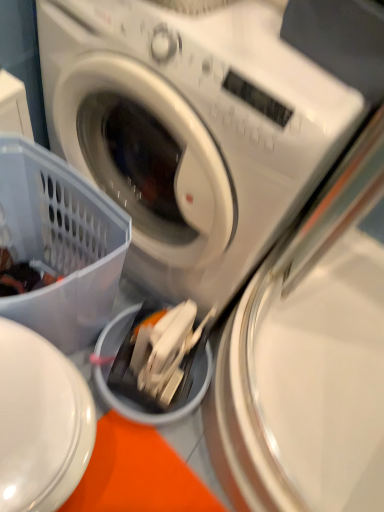
Question: Is white plastic washing machine at center, the first washing machine when ordered from top to bottom, further to the viewer compared to metallic silver washing machine at center, which appears as the 1th washing machine when ordered from the bottom?

Choices:
 (A) yes
 (B) no

Answer: (B)

Question: Is metallic silver washing machine at center, which appears as the 1th washing machine when ordered from the bottom, inside white plastic washing machine at center, the first washing machine when ordered from top to bottom?

Choices:
 (A) no
 (B) yes

Answer: (A)

Question: Is white plastic washing machine at center, positioned as the 2th washing machine in bottom-to-top order, oriented towards metallic silver washing machine at center, positioned as the 2th washing machine in top-to-bottom order?

Choices:
 (A) yes
 (B) no

Answer: (B)

Question: Considering the relative positions of white plastic washing machine at center, positioned as the 2th washing machine in bottom-to-top order, and metallic silver washing machine at center, positioned as the 2th washing machine in top-to-bottom order, in the image provided, is white plastic washing machine at center, positioned as the 2th washing machine in bottom-to-top order, to the right of metallic silver washing machine at center, positioned as the 2th washing machine in top-to-bottom order, from the viewer's perspective?

Choices:
 (A) no
 (B) yes

Answer: (A)

Question: Does white plastic washing machine at center, the first washing machine when ordered from top to bottom, have a smaller size compared to metallic silver washing machine at center, positioned as the 2th washing machine in top-to-bottom order?

Choices:
 (A) yes
 (B) no

Answer: (B)

Question: Is translucent plastic basket at lower left inside or outside of metallic silver washing machine at center, positioned as the 2th washing machine in top-to-bottom order?

Choices:
 (A) outside
 (B) inside

Answer: (A)

Question: In the image, is translucent plastic basket at lower left positioned in front of or behind metallic silver washing machine at center, positioned as the 2th washing machine in top-to-bottom order?

Choices:
 (A) behind
 (B) front

Answer: (B)

Question: From a real-world perspective, is translucent plastic basket at lower left positioned above or below metallic silver washing machine at center, which appears as the 1th washing machine when ordered from the bottom?

Choices:
 (A) above
 (B) below

Answer: (A)

Question: Is point (69, 344) positioned closer to the camera than point (228, 401)?

Choices:
 (A) farther
 (B) closer

Answer: (A)

Question: Is white plastic washing machine at center, positioned as the 2th washing machine in bottom-to-top order, situated inside metallic silver washing machine at center, positioned as the 2th washing machine in top-to-bottom order, or outside?

Choices:
 (A) inside
 (B) outside

Answer: (B)

Question: Does point pyautogui.click(x=195, y=74) appear closer or farther from the camera than point pyautogui.click(x=347, y=474)?

Choices:
 (A) farther
 (B) closer

Answer: (B)

Question: From the image's perspective, is white plastic washing machine at center, positioned as the 2th washing machine in bottom-to-top order, positioned above or below metallic silver washing machine at center, positioned as the 2th washing machine in top-to-bottom order?

Choices:
 (A) above
 (B) below

Answer: (A)

Question: Is white plastic washing machine at center, positioned as the 2th washing machine in bottom-to-top order, taller or shorter than metallic silver washing machine at center, which appears as the 1th washing machine when ordered from the bottom?

Choices:
 (A) short
 (B) tall

Answer: (B)

Question: Is point (246, 41) closer or farther from the camera than point (11, 302)?

Choices:
 (A) farther
 (B) closer

Answer: (B)

Question: From their relative heights in the image, would you say white plastic washing machine at center, positioned as the 2th washing machine in bottom-to-top order, is taller or shorter than translucent plastic basket at lower left?

Choices:
 (A) short
 (B) tall

Answer: (B)